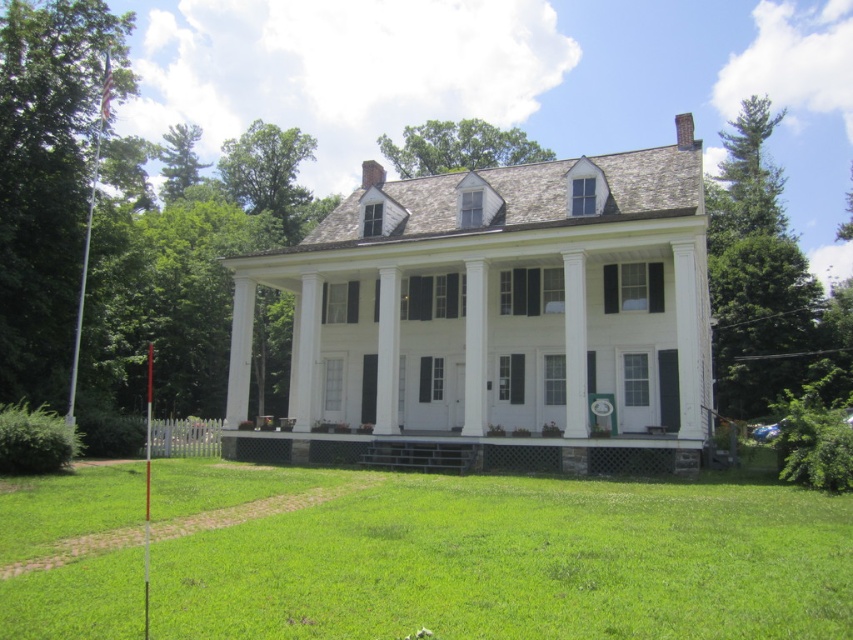
You are standing in front of the house and want to walk from the stone porch at center to the white painted wood house at center. Which direction should you move?

A: The white painted wood house at center is positioned on the right side of stone porch at center, so you should move to the right to reach it.

You are standing at the point marked as point (x=496, y=317) in the image. What is the material of the house at your current location?

The point (x=496, y=317) marks the white painted wood house at center, so the material at that location is white painted wood.